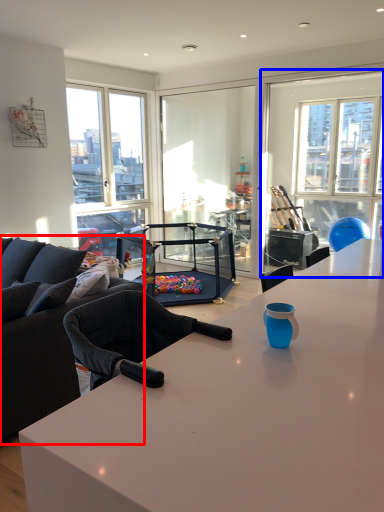
Question: Which object appears farthest to the camera in this image, studio couch (highlighted by a red box) or window screen (highlighted by a blue box)?

Choices:
 (A) studio couch
 (B) window screen

Answer: (B)